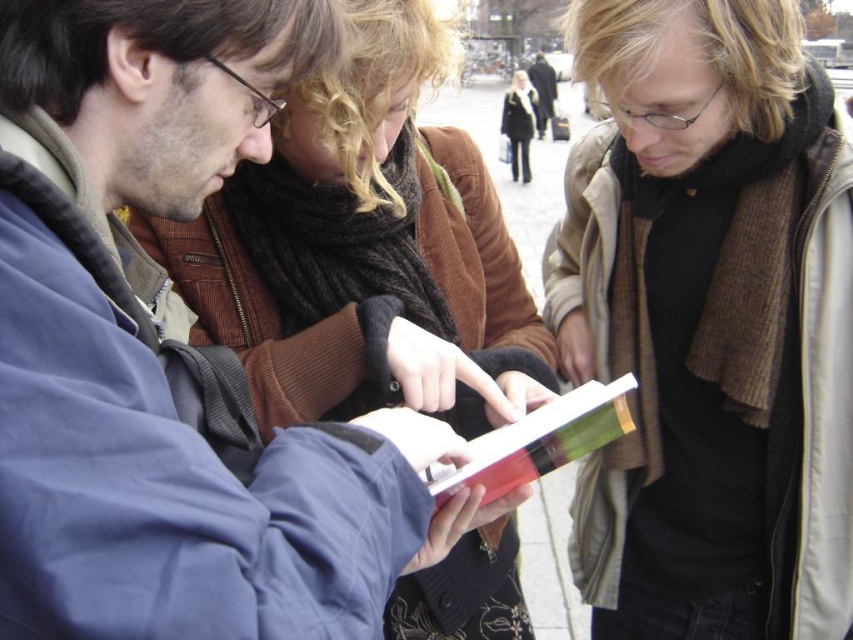
Question: Which object appears farthest from the camera in this image?

Choices:
 (A) black wool coat at center
 (B) brown wool scarf at center

Answer: (A)

Question: Is brown wool scarf at center further to camera compared to red glossy book at center?

Choices:
 (A) yes
 (B) no

Answer: (B)

Question: Can you confirm if brown wool scarf at center is wider than black wool coat at center?

Choices:
 (A) no
 (B) yes

Answer: (B)

Question: Does brown wool scarf at center have a lesser width compared to black wool coat at upper center?

Choices:
 (A) no
 (B) yes

Answer: (A)

Question: Which object is positioned closest to the red glossy book at center?

Choices:
 (A) black wool coat at upper center
 (B) brown wool scarf at center

Answer: (B)

Question: Which of the following is the closest to the observer?

Choices:
 (A) (589, 381)
 (B) (350, 378)
 (C) (537, 131)
 (D) (515, 141)

Answer: (B)